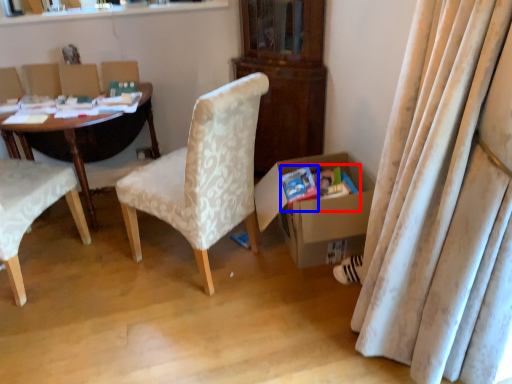
Question: Which point is further to the camera, magazine (highlighted by a red box) or paperback book (highlighted by a blue box)?

Choices:
 (A) magazine
 (B) paperback book

Answer: (A)